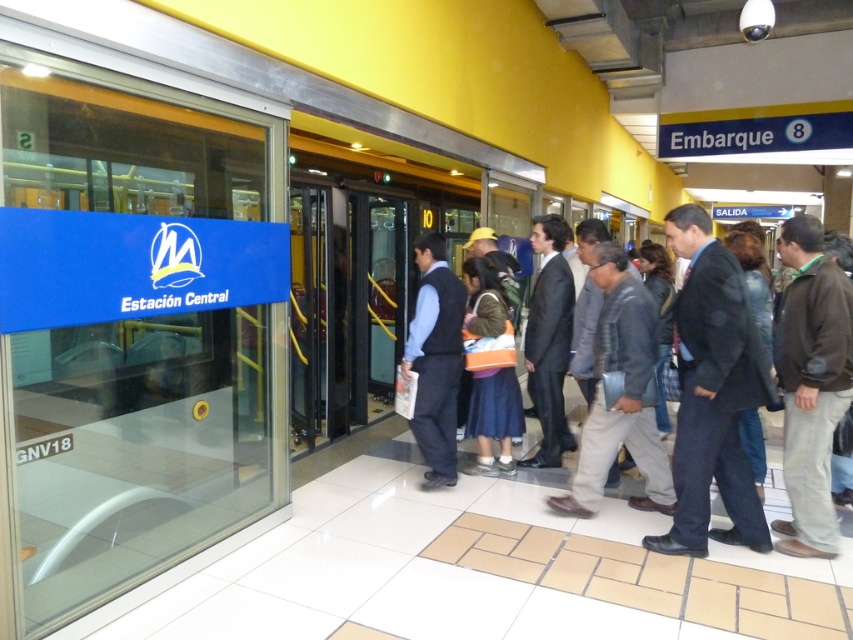
Question: Can you confirm if dark suit at center is positioned to the right of orange fabric backpack at center?

Choices:
 (A) yes
 (B) no

Answer: (A)

Question: Does dark gray suit at center appear over brown fabric jacket at right?

Choices:
 (A) yes
 (B) no

Answer: (B)

Question: Which object is farther from the camera taking this photo?

Choices:
 (A) transparent glass door at left
 (B) dark blue suit at center
 (C) dark gray suit at center

Answer: (C)

Question: Which point is closer to the camera?

Choices:
 (A) (747, 360)
 (B) (740, 308)
 (C) (434, 364)
 (D) (773, 346)

Answer: (B)

Question: Can you confirm if dark gray suit at center is positioned above brown fabric jacket at right?

Choices:
 (A) yes
 (B) no

Answer: (B)

Question: Estimate the real-world distances between objects in this image. Which object is closer to the orange fabric backpack at center?

Choices:
 (A) transparent glass door at left
 (B) dark suit at center

Answer: (B)